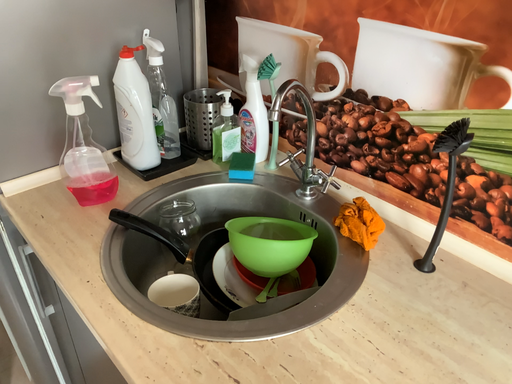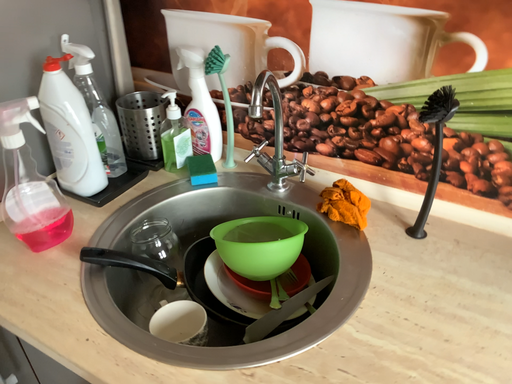
Question: How did the camera likely rotate when shooting the video?

Choices:
 (A) rotated right
 (B) rotated left

Answer: (A)